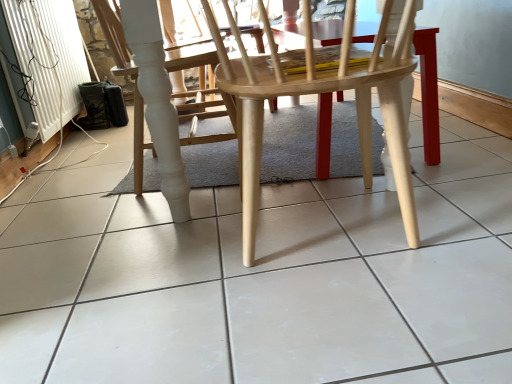
Locate an element on the screen. vacant space situated on the left part of white glossy chair at center, arranged as the second chair when viewed from the front is located at coordinates (87, 181).